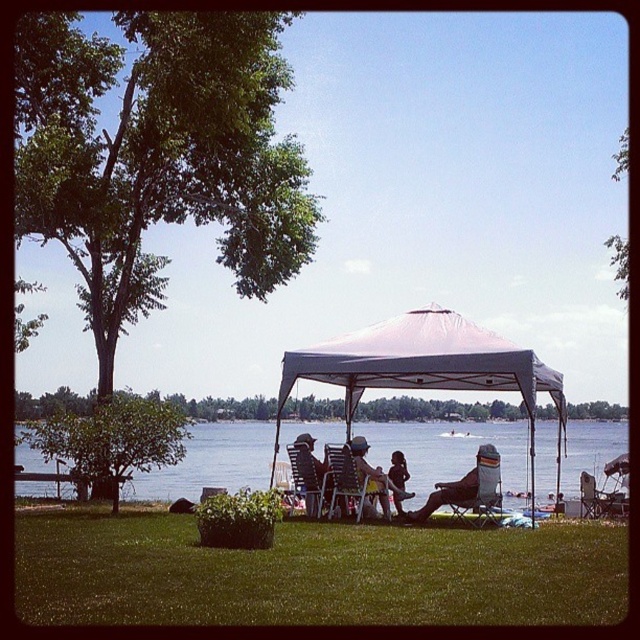
Question: Is clear blue water at center in front of metallic gray folding chair at center?

Choices:
 (A) no
 (B) yes

Answer: (A)

Question: Which point appears closest to the camera in this image?

Choices:
 (A) (397, 467)
 (B) (416, 355)
 (C) (362, 492)
 (D) (589, 476)

Answer: (B)

Question: From the image, what is the correct spatial relationship of white fabric canopy at center in relation to metallic silver chair at lower right?

Choices:
 (A) below
 (B) above

Answer: (B)

Question: Estimate the real-world distances between objects in this image. Which object is farther from the smooth skin child at center?

Choices:
 (A) white fabric canopy at center
 (B) orange fabric chair at lower right
 (C) metallic silver chair at lower right

Answer: (C)

Question: Estimate the real-world distances between objects in this image. Which object is closer to the matte blue shorts at center?

Choices:
 (A) smooth skin child at center
 (B) metallic silver chair at lower right

Answer: (A)

Question: Can you confirm if orange fabric chair at lower right is thinner than matte black chair at center?

Choices:
 (A) no
 (B) yes

Answer: (A)